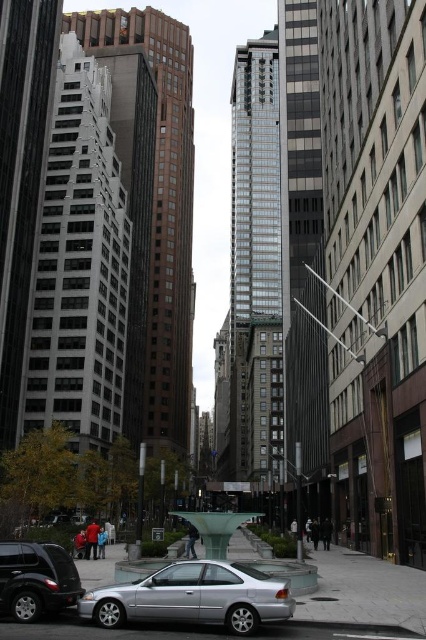
Question: Which of the following is the farthest from the observer?

Choices:
 (A) silver metallic car at lower left
 (B) shiny black suv at lower left

Answer: (B)

Question: Which point is farther from the camera taking this photo?

Choices:
 (A) (14, 598)
 (B) (89, 593)

Answer: (B)

Question: Which point is closer to the camera?

Choices:
 (A) [51, 577]
 (B) [253, 614]

Answer: (B)

Question: Can you confirm if silver metallic car at lower left is wider than shiny black suv at lower left?

Choices:
 (A) no
 (B) yes

Answer: (B)

Question: Observing the image, what is the correct spatial positioning of silver metallic car at lower left in reference to shiny black suv at lower left?

Choices:
 (A) right
 (B) left

Answer: (A)

Question: Can you confirm if silver metallic car at lower left is smaller than shiny black suv at lower left?

Choices:
 (A) yes
 (B) no

Answer: (B)